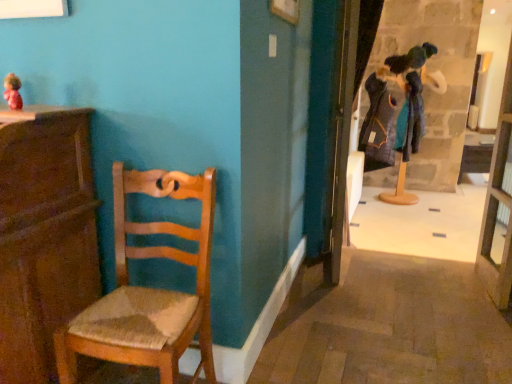
Question: Is wooden door at center at the left side of transparent glass door at right?

Choices:
 (A) yes
 (B) no

Answer: (A)

Question: Is the position of wooden door at center less distant than that of transparent glass door at right?

Choices:
 (A) no
 (B) yes

Answer: (A)

Question: From a real-world perspective, is wooden door at center located beneath transparent glass door at right?

Choices:
 (A) yes
 (B) no

Answer: (B)

Question: Can you confirm if wooden door at center is shorter than transparent glass door at right?

Choices:
 (A) no
 (B) yes

Answer: (A)

Question: Can you confirm if wooden door at center is taller than transparent glass door at right?

Choices:
 (A) no
 (B) yes

Answer: (B)

Question: From the image's perspective, is transparent glass door at right positioned above or below wooden cabinet at left?

Choices:
 (A) below
 (B) above

Answer: (B)

Question: Considering their positions, is transparent glass door at right located in front of or behind wooden cabinet at left?

Choices:
 (A) behind
 (B) front

Answer: (A)

Question: From their relative heights in the image, would you say transparent glass door at right is taller or shorter than wooden cabinet at left?

Choices:
 (A) tall
 (B) short

Answer: (A)

Question: Based on their sizes in the image, would you say transparent glass door at right is bigger or smaller than wooden cabinet at left?

Choices:
 (A) small
 (B) big

Answer: (A)

Question: Considering the positions of woven wood chair at left and wooden door at center in the image, is woven wood chair at left taller or shorter than wooden door at center?

Choices:
 (A) tall
 (B) short

Answer: (B)

Question: Considering the relative positions of woven wood chair at left and wooden door at center in the image provided, is woven wood chair at left to the left or to the right of wooden door at center?

Choices:
 (A) left
 (B) right

Answer: (A)

Question: From the image's perspective, is woven wood chair at left above or below wooden door at center?

Choices:
 (A) above
 (B) below

Answer: (B)

Question: From a real-world perspective, is woven wood chair at left positioned above or below wooden door at center?

Choices:
 (A) below
 (B) above

Answer: (A)

Question: Considering the positions of point (17, 296) and point (340, 208), is point (17, 296) closer or farther from the camera than point (340, 208)?

Choices:
 (A) farther
 (B) closer

Answer: (B)

Question: In terms of width, does wooden cabinet at left look wider or thinner when compared to wooden door at center?

Choices:
 (A) thin
 (B) wide

Answer: (B)